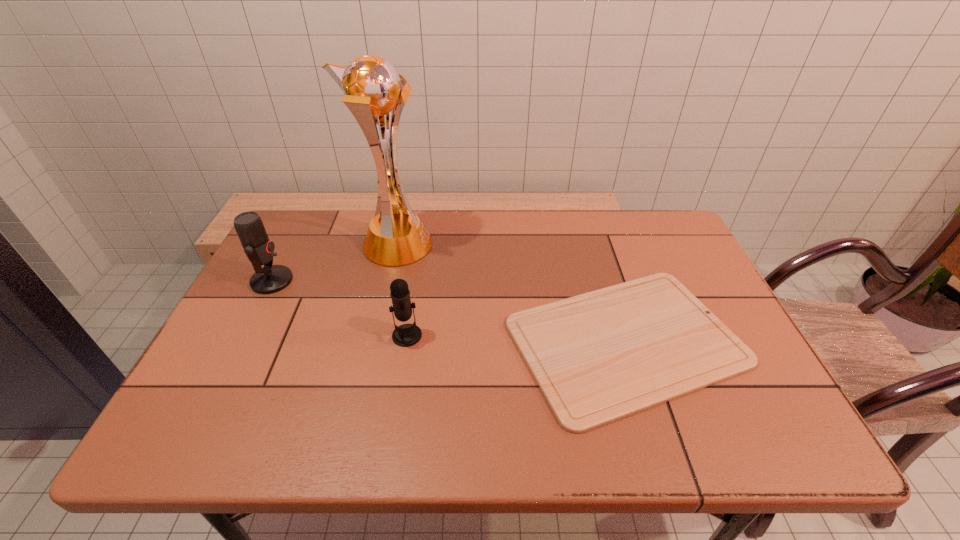
This screenshot has height=540, width=960. I want to click on blank space that satisfies the following two spatial constraints: 1. on the back side of the second shortest object; 2. on the side of the farther microphone with the red ring, so click(416, 281).

This screenshot has width=960, height=540. Identify the location of vacant space that satisfies the following two spatial constraints: 1. on the side of the chopping board with the red ring; 2. on the right side of the leftmost object. (240, 341).